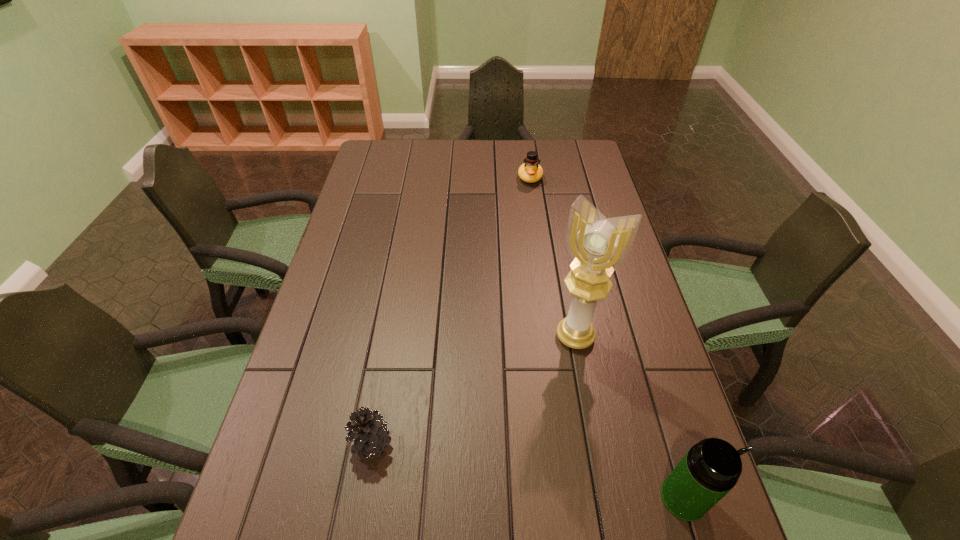
Where is `vacant space in between the duck and the third farthest object`? The width and height of the screenshot is (960, 540). vacant space in between the duck and the third farthest object is located at coordinates (450, 310).

I want to click on vacant point located between the award and the pinecone, so click(x=473, y=389).

Image resolution: width=960 pixels, height=540 pixels. Identify the location of free space between the award and the second tallest object. (629, 417).

Find the location of a particular element. free spot between the leftmost object and the third nearest object is located at coordinates (473, 389).

The height and width of the screenshot is (540, 960). Find the location of `vacant space that's between the second tallest object and the farthest object`. vacant space that's between the second tallest object and the farthest object is located at coordinates (607, 338).

Select which object is the third closest to the nearest object. Please provide its 2D coordinates. Your answer should be formatted as a tuple, i.e. [(x, y)], where the tuple contains the x and y coordinates of a point satisfying the conditions above.

[(530, 172)]

Identify which object is the closest to the rightmost object. Please provide its 2D coordinates. Your answer should be formatted as a tuple, i.e. [(x, y)], where the tuple contains the x and y coordinates of a point satisfying the conditions above.

[(598, 245)]

Where is `blank space that satisfies the following two spatial constraints: 1. on the front side of the rightmost object; 2. from the spout of the leftmost object`? This screenshot has width=960, height=540. blank space that satisfies the following two spatial constraints: 1. on the front side of the rightmost object; 2. from the spout of the leftmost object is located at coordinates (361, 498).